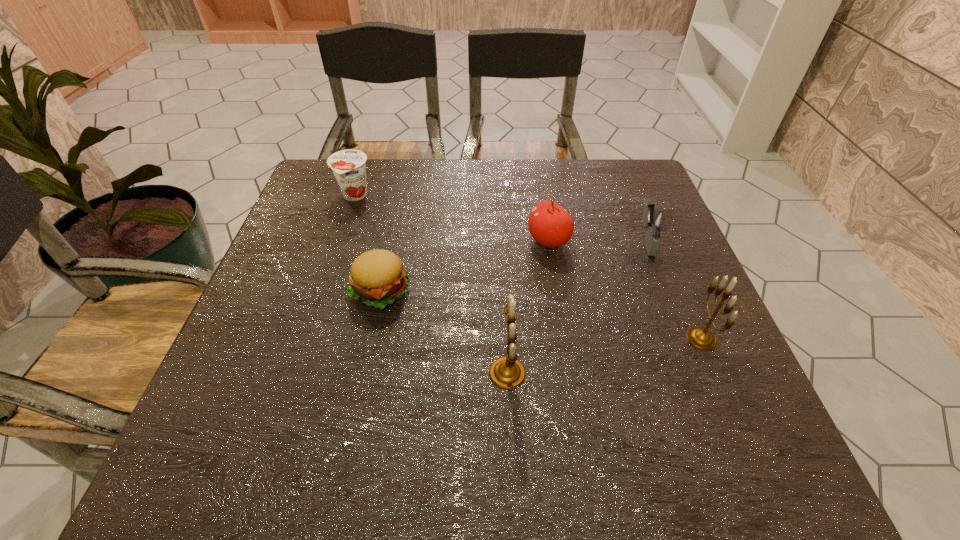
The width and height of the screenshot is (960, 540). Find the location of `free area in between the fourth object from left to right and the tallest object`. free area in between the fourth object from left to right and the tallest object is located at coordinates (528, 307).

Locate an element on the screen. The height and width of the screenshot is (540, 960). blank region between the second tallest object and the apple is located at coordinates (625, 289).

Identify the location of blank region between the shortest object and the igniter. (513, 266).

Identify the location of free space between the shorter candelabrum and the tallest object. The width and height of the screenshot is (960, 540). (604, 355).

Where is `unoccupied area between the fourth object from left to right and the hamburger`? The width and height of the screenshot is (960, 540). unoccupied area between the fourth object from left to right and the hamburger is located at coordinates point(464,266).

Locate an element on the screen. empty space that is in between the hamburger and the igniter is located at coordinates (513, 266).

You are a GUI agent. You are given a task and a screenshot of the screen. Output one action in this format:
    pyautogui.click(x=<x>, y=<y>)
    Task: Click on the empty space that is in between the taller candelabrum and the shortest object
    
    Given the screenshot: What is the action you would take?
    pyautogui.click(x=444, y=332)

Locate an element on the screen. empty space between the igniter and the hamburger is located at coordinates (513, 266).

Locate an element on the screen. free space between the apple and the igniter is located at coordinates (597, 241).

Choose which object is the fourth nearest neighbor to the shortest object. Please provide its 2D coordinates. Your answer should be formatted as a tuple, i.e. [(x, y)], where the tuple contains the x and y coordinates of a point satisfying the conditions above.

[(654, 221)]